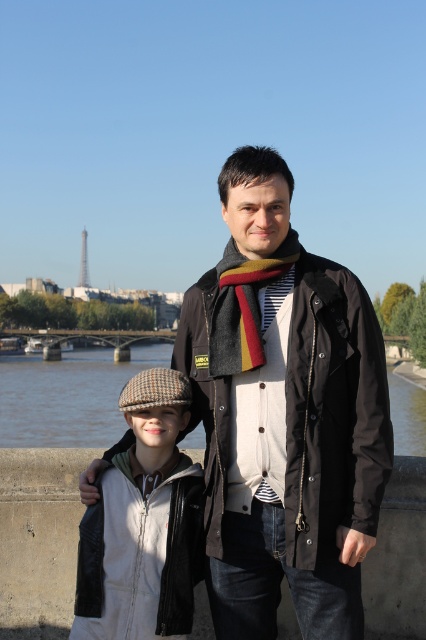
Question: Which of the following is the farthest from the observer?

Choices:
 (A) (342, 444)
 (B) (25, 400)

Answer: (B)

Question: Estimate the real-world distances between objects in this image. Which object is closer to the dark brown jacket at center?

Choices:
 (A) striped wool scarf at center
 (B) herringbone wool cap at center

Answer: (B)

Question: Among these objects, which one is farthest from the camera?

Choices:
 (A) striped wool scarf at center
 (B) herringbone wool cap at center

Answer: (A)

Question: Does herringbone wool cap at center appear on the right side of brown water at lower center?

Choices:
 (A) no
 (B) yes

Answer: (B)

Question: Is black matte jacket at center smaller than herringbone wool cap at center?

Choices:
 (A) yes
 (B) no

Answer: (B)

Question: Where is herringbone wool cap at center located in relation to striped wool scarf at center in the image?

Choices:
 (A) above
 (B) below

Answer: (B)